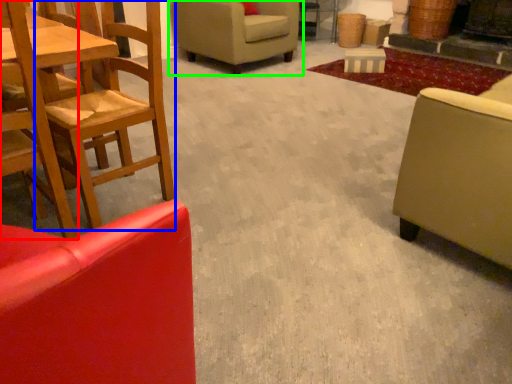
Question: Based on their relative distances, which object is nearer to chair (highlighted by a red box)? Choose from chair (highlighted by a blue box) and chair (highlighted by a green box).

Choices:
 (A) chair
 (B) chair

Answer: (A)